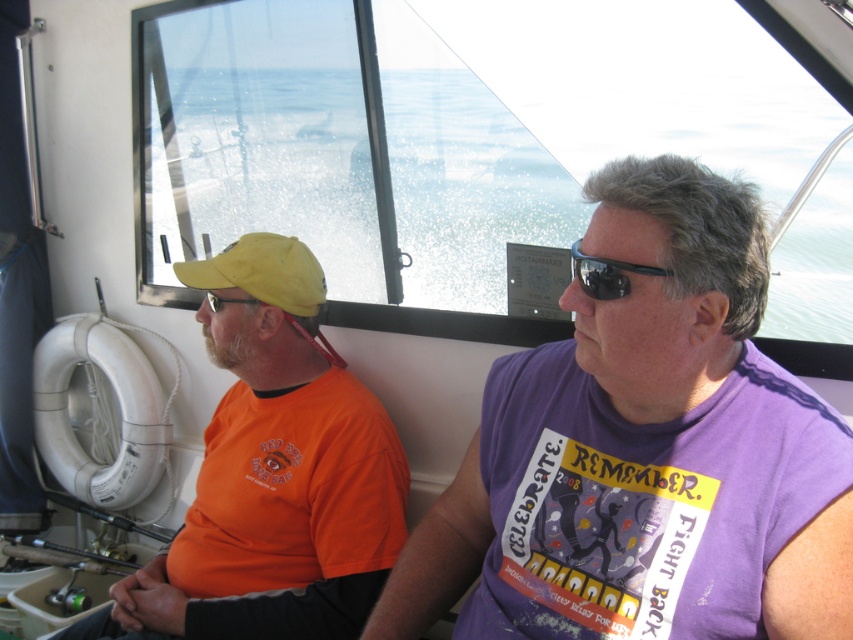
Which of these two, purple cotton shirt at center or orange cotton shirt at left, stands shorter?

purple cotton shirt at center

Measure the distance between point (724, 634) and camera.

A distance of 1.11 meters exists between point (724, 634) and camera.

The width and height of the screenshot is (853, 640). Identify the location of purple cotton shirt at center. (643, 451).

Does purple cotton shirt at center lie in front of blue plastic sunglasses at center?

Yes, it is in front of blue plastic sunglasses at center.

Image resolution: width=853 pixels, height=640 pixels. I want to click on purple cotton shirt at center, so click(643, 451).

Is orange cotton shirt at left wider than yellow fabric baseball cap at upper left?

Indeed, orange cotton shirt at left has a greater width compared to yellow fabric baseball cap at upper left.

Who is positioned more to the right, orange cotton shirt at left or yellow fabric baseball cap at upper left?

yellow fabric baseball cap at upper left is more to the right.

Find the location of a particular element. This screenshot has width=853, height=640. orange cotton shirt at left is located at coordinates (271, 474).